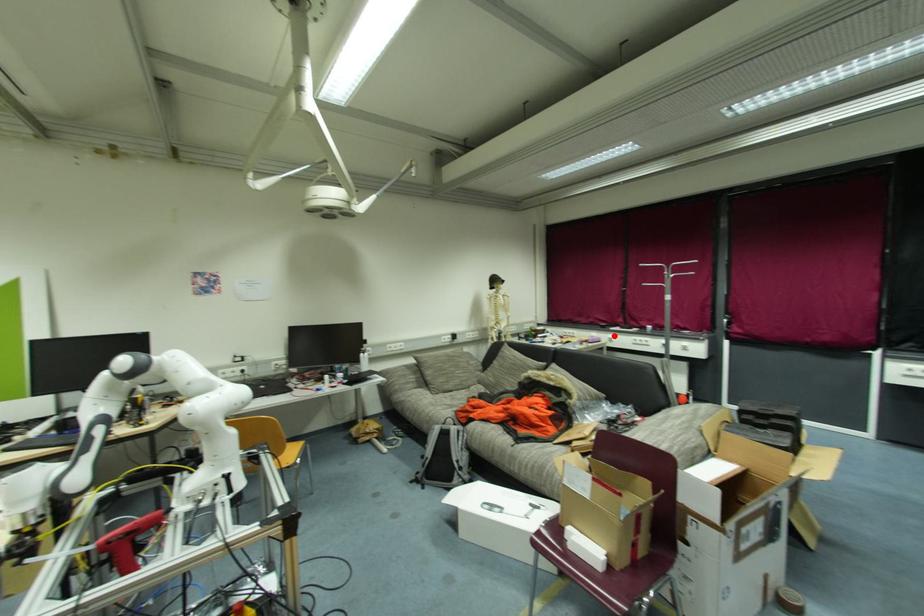
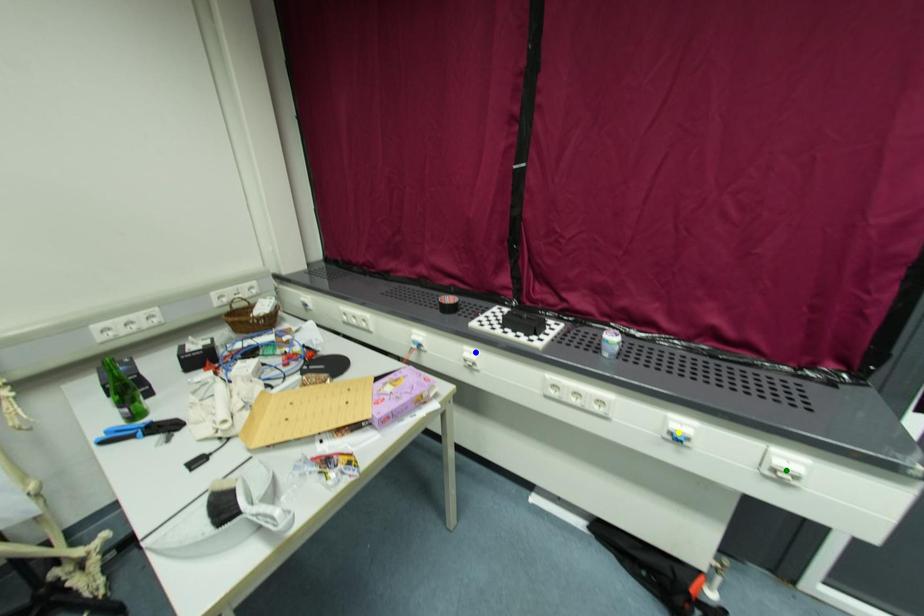
Question: I am providing you with two images of the same scene from different viewpoints. A red point is marked on the first image. You are given multiple points on the second image. Which point in image 2 is actually the same real-world point as the red point in image 1?

Choices:
 (A) blue point
 (B) yellow point
 (C) green point

Answer: (A)